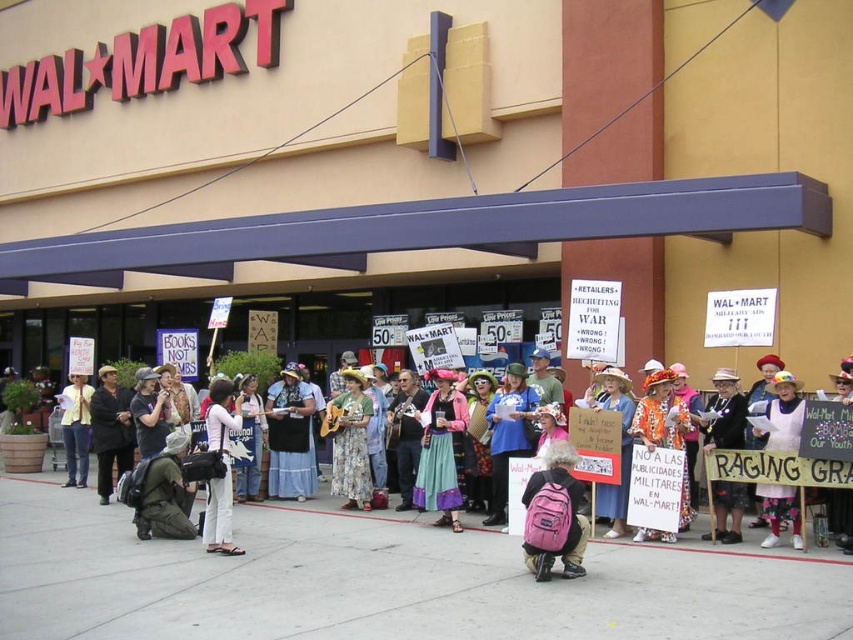
Who is higher up, pink fabric skirt at center or floral fabric dress at center?

Positioned higher is floral fabric dress at center.

Who is positioned more to the right, pink fabric skirt at center or floral fabric dress at center?

floral fabric dress at center is more to the right.

In the scene shown: Who is more distant from viewer, (444, 419) or (631, 428)?

The point (444, 419) is behind.

This screenshot has width=853, height=640. I want to click on pink fabric skirt at center, so click(x=440, y=451).

Is point (277, 461) farther from viewer compared to point (509, 426)?

Yes, it is behind point (509, 426).

In the scene shown: Is blue cotton dress at center bigger than blue cotton shirt at center?

Yes, blue cotton dress at center is bigger than blue cotton shirt at center.

Between point (285, 387) and point (495, 413), which one is positioned in front?

Point (495, 413) is more forward.

The width and height of the screenshot is (853, 640). I want to click on blue cotton dress at center, so pos(289,436).

Can you confirm if concrete sidewalk at center is positioned to the left of white paper sign at center?

Correct, you'll find concrete sidewalk at center to the left of white paper sign at center.

Does concrete sidewalk at center have a greater height compared to white paper sign at center?

No, concrete sidewalk at center is not taller than white paper sign at center.

Who is more distant from viewer, (42,499) or (787,396)?

The point (42,499) is behind.

The image size is (853, 640). Identify the location of concrete sidewalk at center. (383, 580).